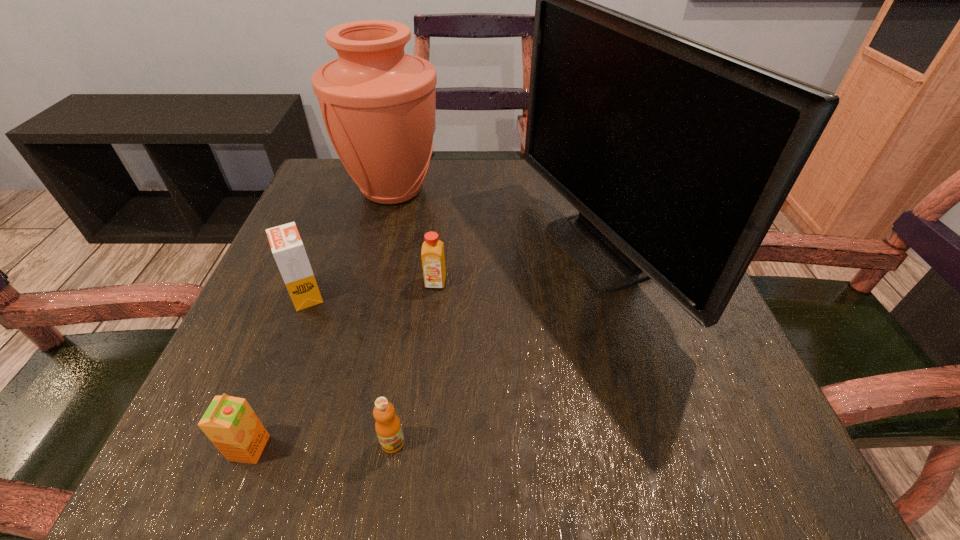
Locate an element on the screen. free space located on the right of the third tallest object is located at coordinates (505, 295).

Image resolution: width=960 pixels, height=540 pixels. Identify the location of free space located 0.180m on the front and back of the rightmost orange juice. (426, 375).

Find the location of `computer monitor located in the far edge section of the desktop`. computer monitor located in the far edge section of the desktop is located at coordinates (678, 156).

In order to click on vase that is at the far edge in this screenshot , I will do `click(378, 103)`.

Where is `vase that is at the left edge`? This screenshot has height=540, width=960. vase that is at the left edge is located at coordinates (378, 103).

The height and width of the screenshot is (540, 960). In order to click on object positioned at the right edge in this screenshot , I will do `click(678, 156)`.

Image resolution: width=960 pixels, height=540 pixels. I want to click on object that is at the far left corner, so click(378, 103).

This screenshot has width=960, height=540. I want to click on object that is positioned at the near left corner, so click(229, 422).

This screenshot has width=960, height=540. I want to click on object located in the far right corner section of the desktop, so click(x=678, y=156).

Find the location of a particular element. free space at the far edge of the desktop is located at coordinates (463, 212).